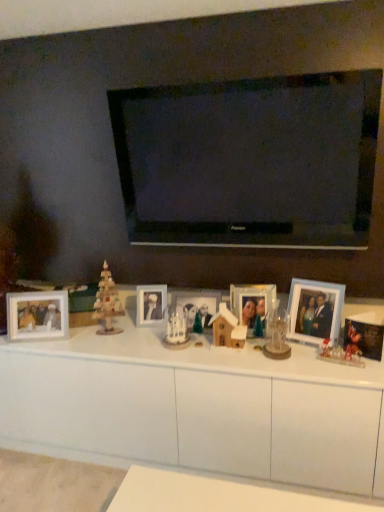
The image size is (384, 512). I want to click on vacant space to the right of wooden christmas tree at left, so click(x=139, y=335).